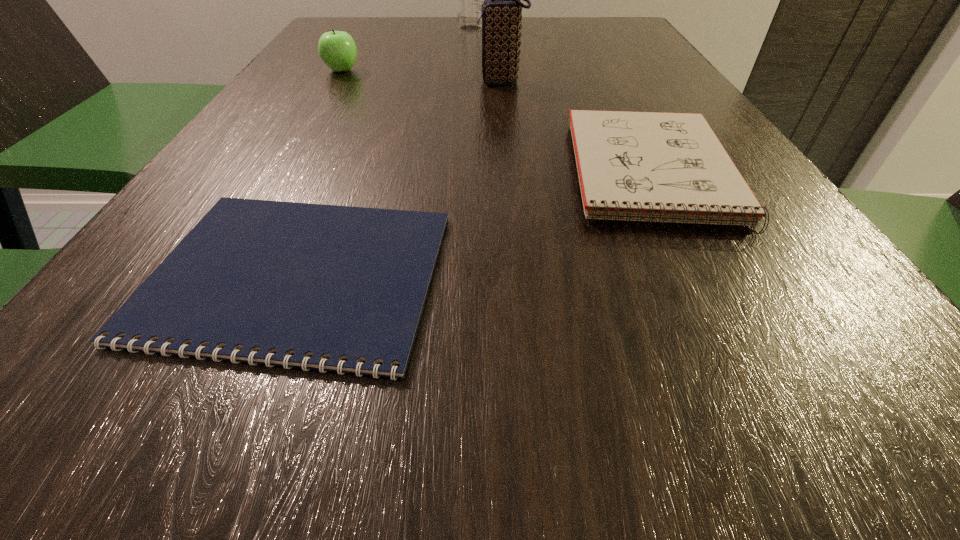
This screenshot has width=960, height=540. Find the location of `the fourth closest object to the shorter notepad`. the fourth closest object to the shorter notepad is located at coordinates (469, 0).

Locate an element on the screen. Image resolution: width=960 pixels, height=540 pixels. free region that satisfies the following two spatial constraints: 1. on the front label of the tallest object; 2. on the front side of the left notepad is located at coordinates (459, 276).

Locate an element on the screen. vacant space that satisfies the following two spatial constraints: 1. with the zip open on the clutch bag; 2. on the front side of the left notepad is located at coordinates (518, 276).

What are the coordinates of `free space that satisfies the following two spatial constraints: 1. on the front label of the tallest object; 2. on the left side of the taller notepad` in the screenshot? It's located at (464, 171).